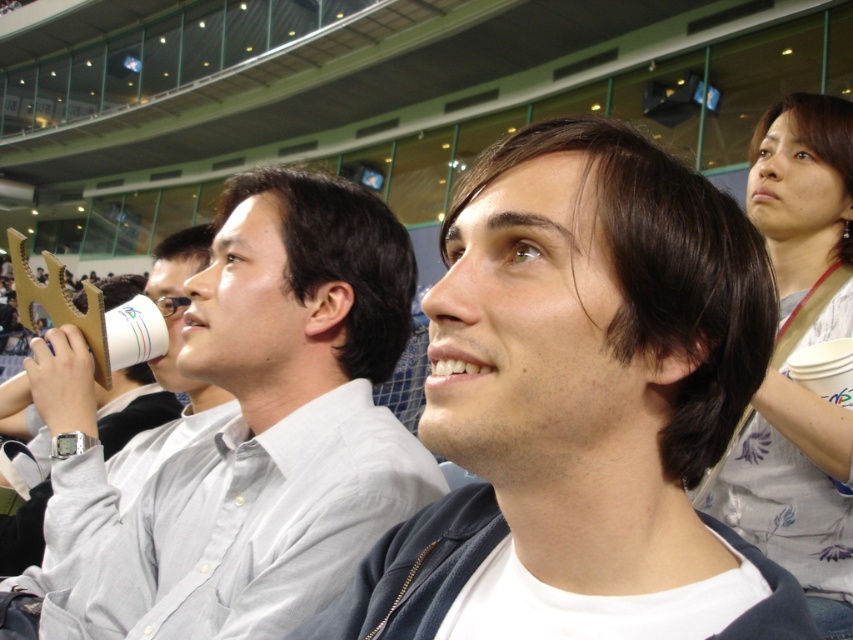
You are a photographer at the stadium. You want to take a photo of the matte white shirt at center and the white paper cup at center. Which object should you focus on first if you want to capture both in the same frame without moving the camera?

You should focus on the matte white shirt at center first because it is shorter than the white paper cup at center, so adjusting the focus to the closer object ensures both will be in the frame.

You are a photographer positioned at the front of the stadium, aiming to capture a clear shot of the matte white shirt at center and the white paper cup at center. Since both are in your viewfinder, which object should you focus on first to ensure sharpness?

The matte white shirt at center is closer to the viewer than the white paper cup at center, so you should focus on the matte white shirt at center first to ensure it is in sharp focus before adjusting for the white paper cup at center.

You are a photographer at the event and want to capture both the matte white shirt at center and the white paper cup at center in a single shot. Which object should you position closer to the left side of your camera frame to ensure both are visible?

To ensure both the matte white shirt at center and the white paper cup at center are visible, position the white paper cup at center closer to the left side of your camera frame since the matte white shirt at center is already to the right of it.